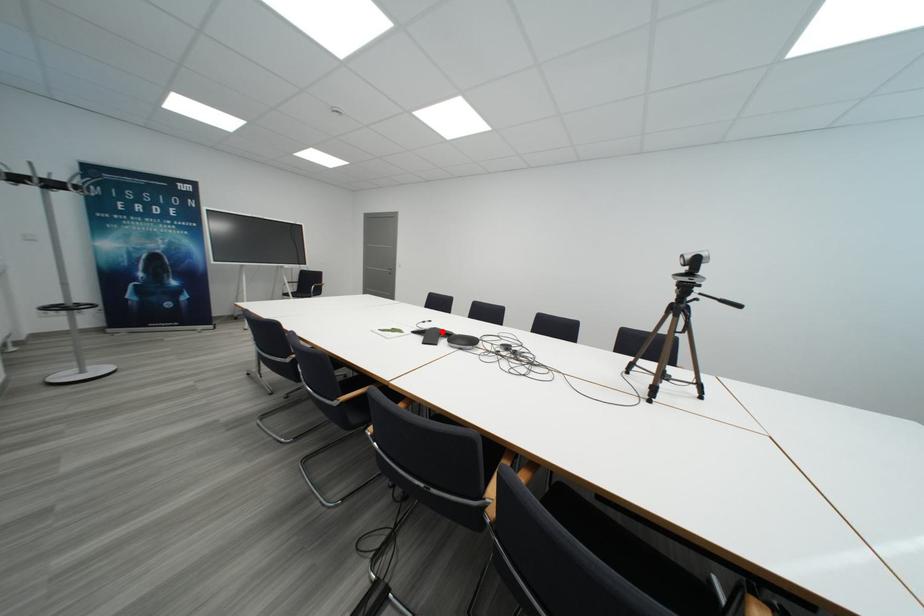
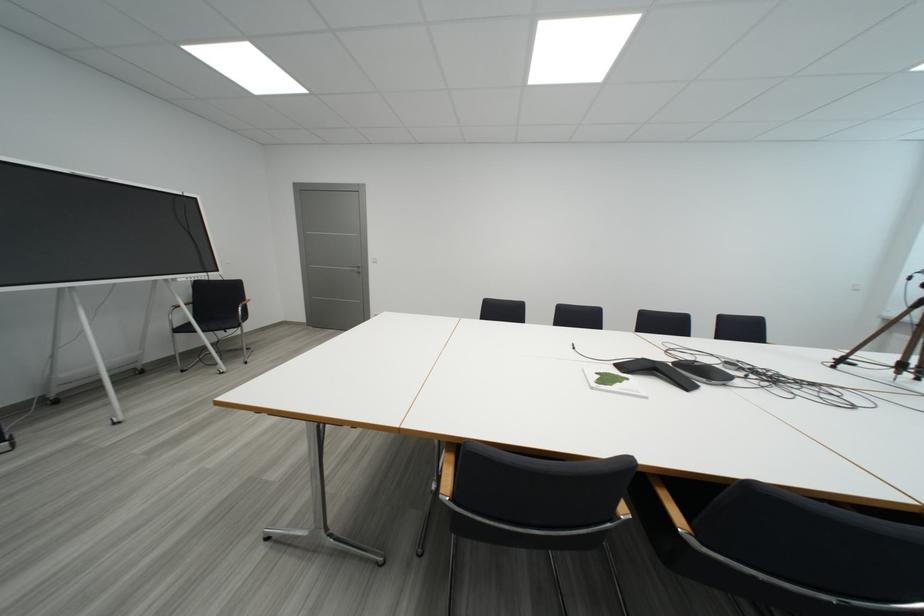
In the second image, find the point that corresponds to the highlighted location in the first image.

(651, 363)